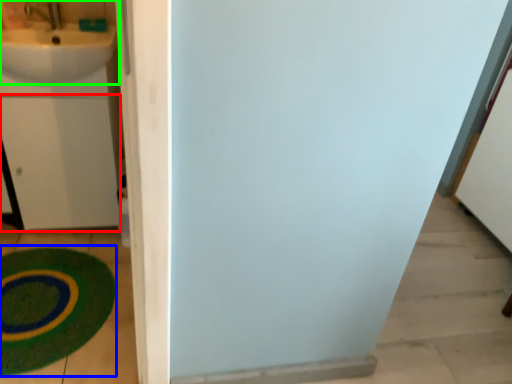
Question: Which object is positioned farthest from drawer (highlighted by a red box)? Select from bath mat (highlighted by a blue box) and sink (highlighted by a green box).

Choices:
 (A) bath mat
 (B) sink

Answer: (A)